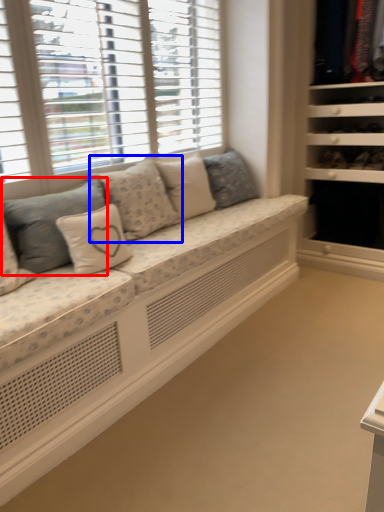
Question: Which point is closer to the camera, pillow (highlighted by a red box) or pillow (highlighted by a blue box)?

Choices:
 (A) pillow
 (B) pillow

Answer: (A)